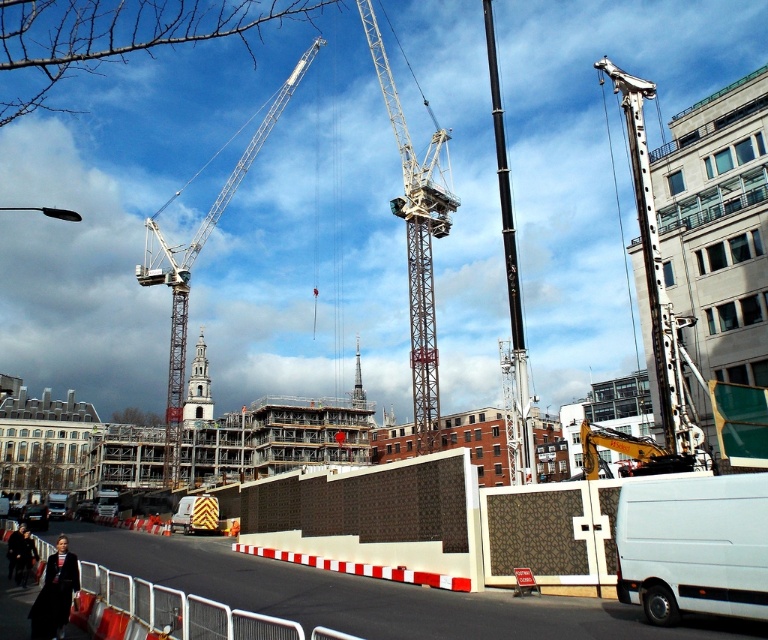
You are a delivery driver who needs to park your truck, which is 3 meters wide, in this construction site. You see the black metallic crane at center and the dark brown leather jacket at lower left. Can you determine if there is enough space between them to park your truck?

The black metallic crane at center is wider than the dark brown leather jacket at lower left. However, the exact distance between them isn not provided, so it is impossible to determine if there is enough space for the truck.

You are a delivery driver who needs to park your truck near the construction site. You see the black metallic crane at center and the dark brown leather jacket at lower left. Which object should you avoid parking too close to for safety reasons?

You should avoid parking too close to the black metallic crane at center because it is bigger than the dark brown leather jacket at lower left and likely poses a greater safety risk due to its size and potential movement during construction operations.